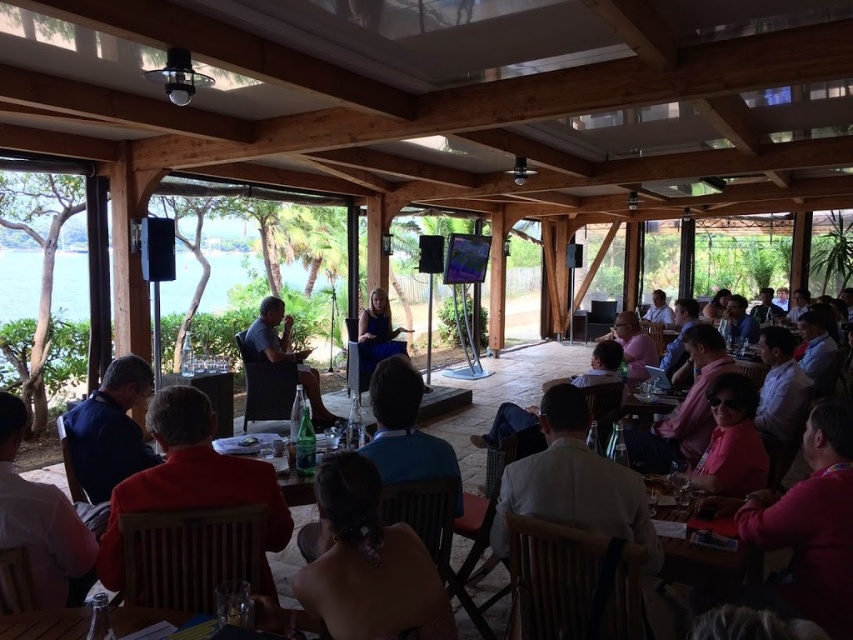
You are attending a conference in the pavilion and notice the matte black hair at center and the clear plastic table at center. Which object is positioned higher in the scene?

The matte black hair at center is positioned higher than the clear plastic table at center.

You are standing at the entrance of the wooden pavilion and want to locate the blue shirt at lower left. Based on the coordinates provided, where would you look relative to the entrance?

The blue shirt at lower left is located at coordinates point (109, 429), which would be to the right side of the entrance and closer to the bottom of the pavilion.